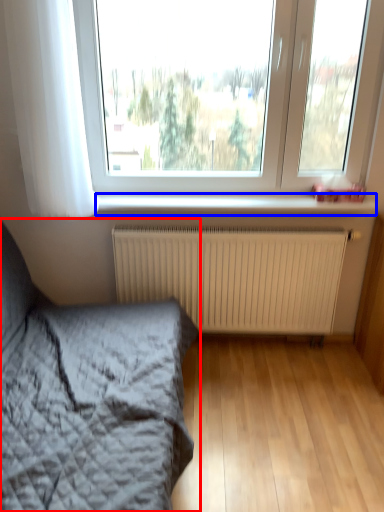
Question: Which object appears farthest to the camera in this image, bed (highlighted by a red box) or window sill (highlighted by a blue box)?

Choices:
 (A) bed
 (B) window sill

Answer: (B)